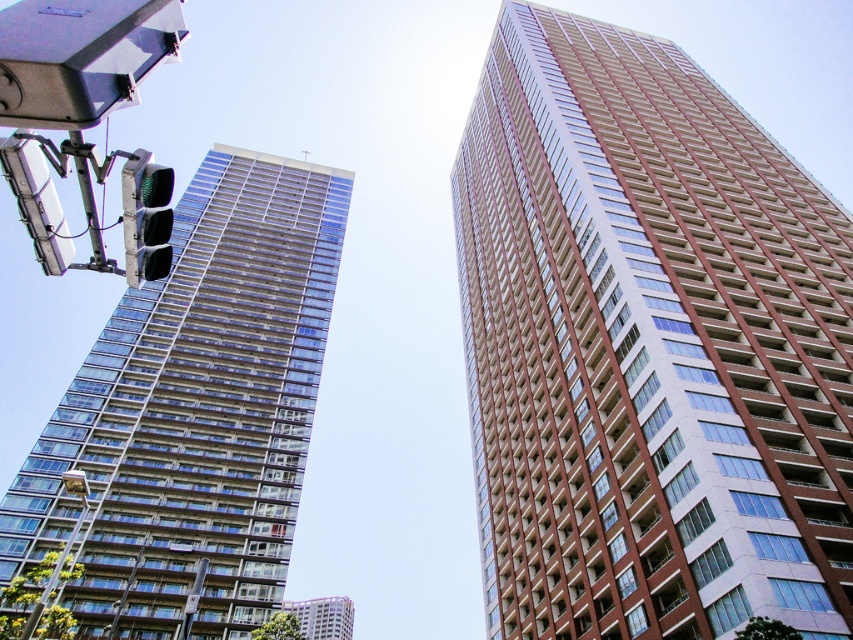
Question: Is green glass traffic light at upper left thinner than metallic traffic light at left?

Choices:
 (A) yes
 (B) no

Answer: (B)

Question: Which point is farther from the camera taking this photo?

Choices:
 (A) (317, 246)
 (B) (48, 266)
 (C) (337, 616)

Answer: (C)

Question: Does clear glass building at left appear on the left side of matte glass building at lower center?

Choices:
 (A) no
 (B) yes

Answer: (A)

Question: Which object appears closest to the camera in this image?

Choices:
 (A) green glass traffic light at upper left
 (B) matte glass building at lower center

Answer: (A)

Question: Is brown brick building at center bigger than matte glass building at lower center?

Choices:
 (A) no
 (B) yes

Answer: (A)

Question: Estimate the real-world distances between objects in this image. Which object is closer to the matte glass building at lower center?

Choices:
 (A) brown brick building at center
 (B) metallic traffic light at left

Answer: (A)